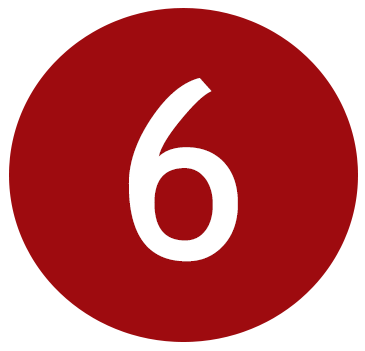
This screenshot has width=365, height=351. Find the location of `corner`. corner is located at coordinates (198, 78), (211, 90).